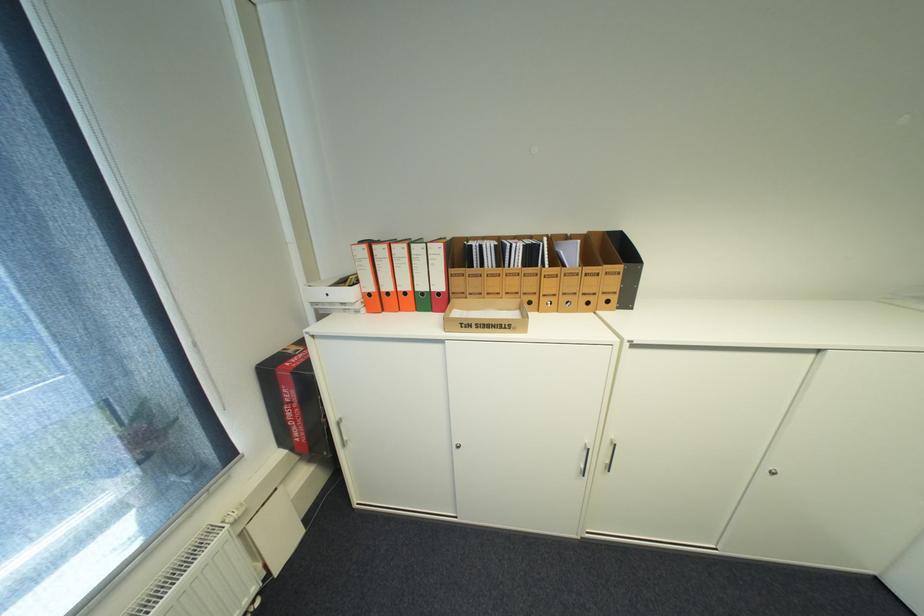
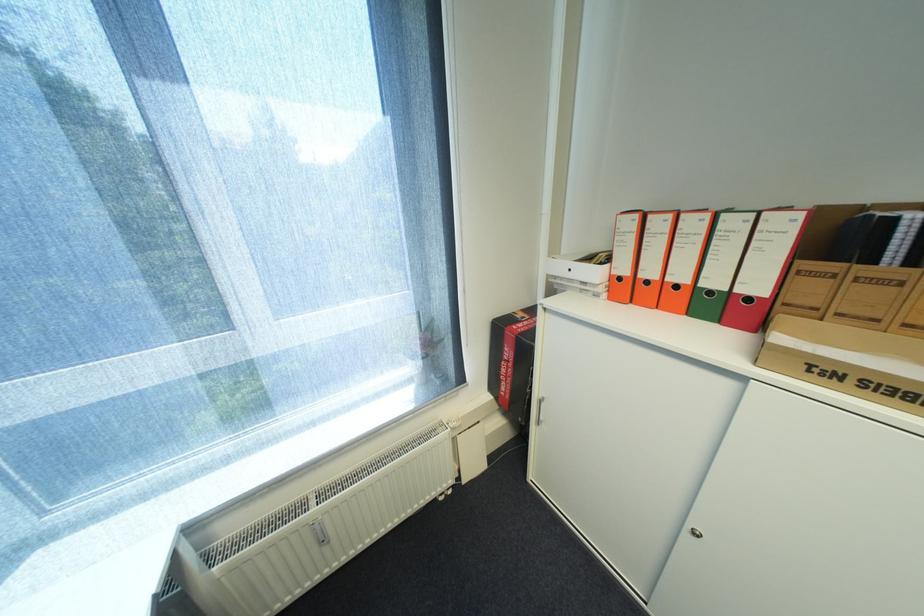
Where in the second image is the point corresponding to the point at 378,294 from the first image?

(627, 278)